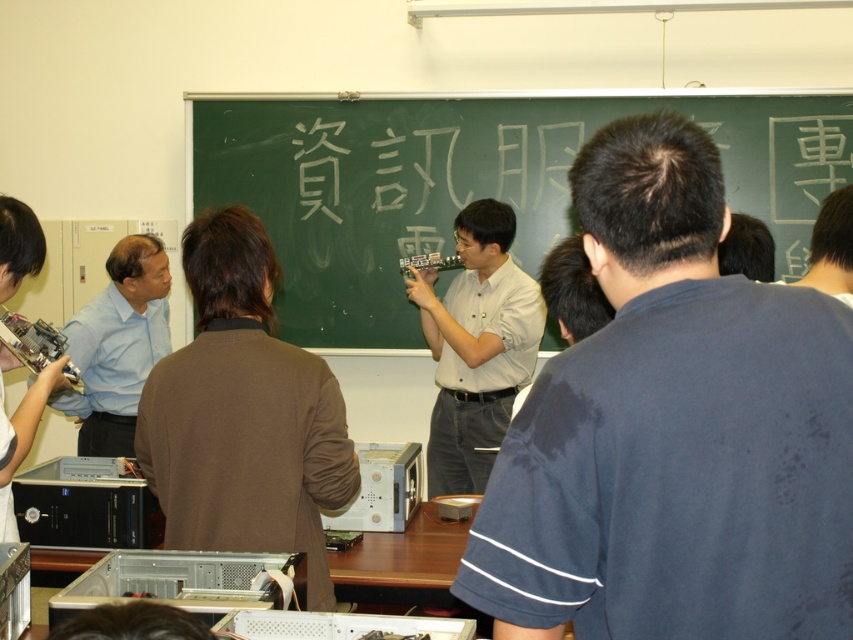
Does green chalkboard at center appear on the right side of light blue shirt at left?

Correct, you'll find green chalkboard at center to the right of light blue shirt at left.

Can you confirm if green chalkboard at center is bigger than light blue shirt at left?

Correct, green chalkboard at center is larger in size than light blue shirt at left.

Is point (817, 109) positioned in front of point (105, 320)?

No.

I want to click on green chalkboard at center, so click(469, 182).

Can you confirm if white chalk writing at center is shorter than white glossy shirt at center?

Yes.

Is white chalk writing at center wider than white glossy shirt at center?

Yes, white chalk writing at center is wider than white glossy shirt at center.

Which is in front, point (544, 198) or point (467, 468)?

Positioned in front is point (467, 468).

You are a GUI agent. You are given a task and a screenshot of the screen. Output one action in this format:
    pyautogui.click(x=<x>, y=<y>)
    Task: Click on the white chalk writing at center
    
    Given the screenshot: What is the action you would take?
    pyautogui.click(x=425, y=182)

Which is more to the right, white glossy shirt at center or light blue shirt at left?

From the viewer's perspective, white glossy shirt at center appears more on the right side.

Can you confirm if white glossy shirt at center is positioned to the right of light blue shirt at left?

Yes, white glossy shirt at center is to the right of light blue shirt at left.

Is point (532, 333) farther from viewer compared to point (151, 282)?

Yes, it is.

You are a GUI agent. You are given a task and a screenshot of the screen. Output one action in this format:
    pyautogui.click(x=<x>, y=<y>)
    Task: Click on the white glossy shirt at center
    
    Given the screenshot: What is the action you would take?
    pyautogui.click(x=476, y=346)